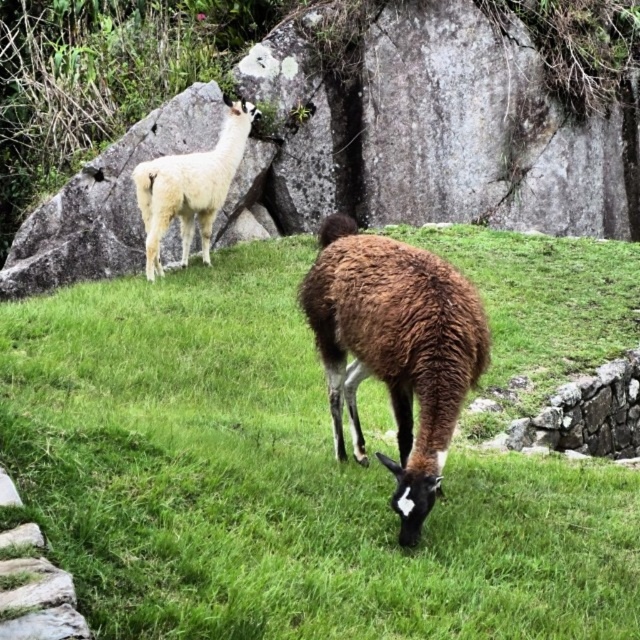
You are a hiker who wants to take a photo of both the brown woolen llama at center and the white woolly alpaca at upper left in the same frame. Given that your camera has a maximum zoom range of 5 meters, will you be able to capture both animals in a single photo without moving closer?

The distance between the brown woolen llama at center and the white woolly alpaca at upper left is 6.14 meters. Since your camera can only zoom up to 5 meters, you won not be able to capture both animals in a single photo without moving closer.

You are a photographer trying to capture both the brown woolen llama at center and the white woolly alpaca at upper left in a single frame. Based on their sizes, which animal should you focus on first to ensure both fit in the shot?

The brown woolen llama at center is shorter than the white woolly alpaca at upper left. To ensure both fit in the shot, focus on positioning the taller white woolly alpaca at upper left first, then adjust the frame to include the shorter brown woolen llama at center.